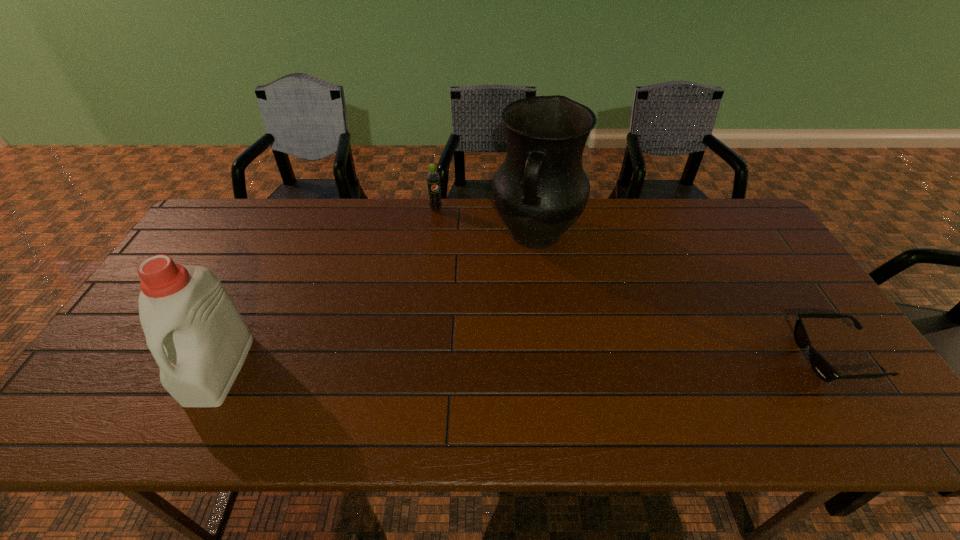
At what (x,y) coordinates should I click in order to perform the action: click on free spot that satisfies the following two spatial constraints: 1. on the front side of the sunglasses; 2. on the front-facing side of the pitcher. Please return your answer as a coordinate pair (x, y). Looking at the image, I should click on (553, 357).